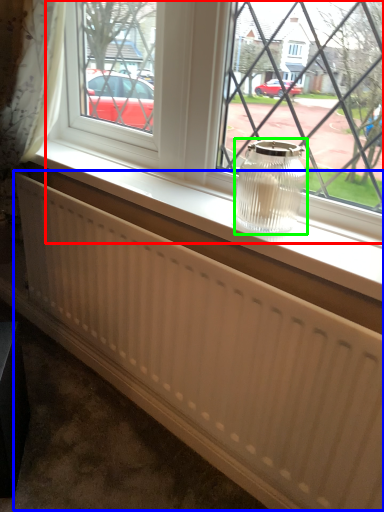
Question: Estimate the real-world distances between objects in this image. Which object is farther from window (highlighted by a red box), radiator (highlighted by a blue box) or glass vase (highlighted by a green box)?

Choices:
 (A) radiator
 (B) glass vase

Answer: (A)